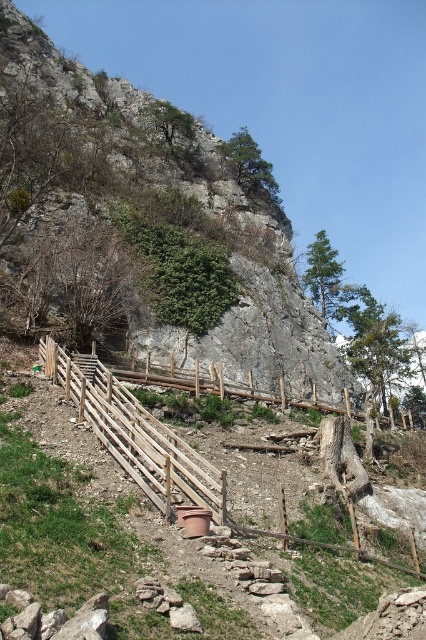
Is point (262, 326) positioned behind point (123, 369)?

Yes.

Is rough stone hill at center shorter than wooden fence at center?

No.

Describe the element at coordinates (255, 305) in the screenshot. The height and width of the screenshot is (640, 426). I see `rough stone hill at center` at that location.

Image resolution: width=426 pixels, height=640 pixels. I want to click on rough stone hill at center, so click(x=255, y=305).

Find the location of a particular element. The width and height of the screenshot is (426, 640). rough stone hill at center is located at coordinates (255, 305).

Does wooden fence at lower center have a larger size compared to wooden fence at center?

No.

The width and height of the screenshot is (426, 640). In order to click on wooden fence at lower center in this screenshot , I will do `click(155, 445)`.

Locate an element on the screen. This screenshot has height=640, width=426. wooden fence at lower center is located at coordinates (155, 445).